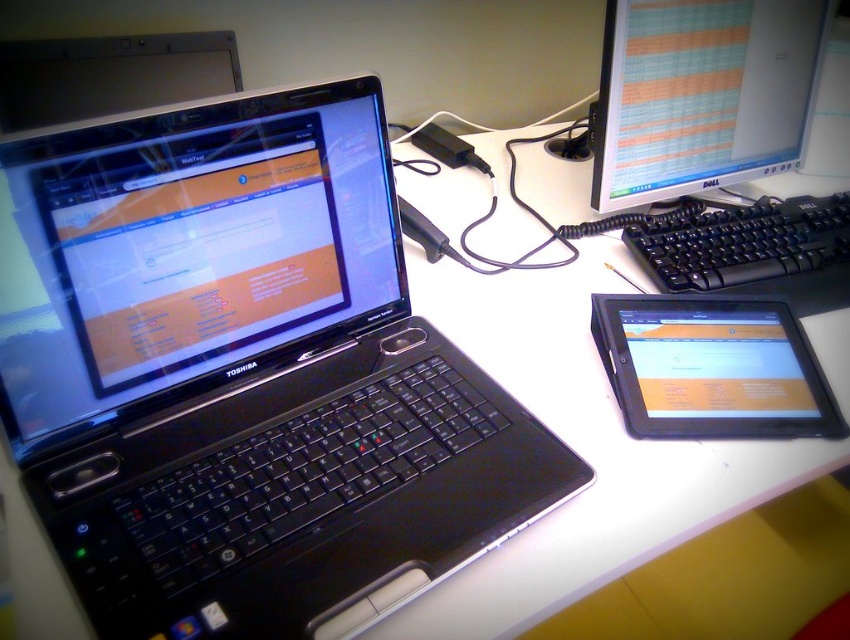
Does black plastic laptop at left have a smaller size compared to matte plastic monitor at upper right?

No.

Can you confirm if black plastic laptop at left is positioned to the left of matte plastic monitor at upper right?

Yes, black plastic laptop at left is to the left of matte plastic monitor at upper right.

Does point (364, 433) lie in front of point (768, 45)?

That is True.

Identify the location of black plastic laptop at left. The height and width of the screenshot is (640, 850). (242, 374).

Which of these two, black matte tablet at lower right or black plastic keyboard at right, stands taller?

black plastic keyboard at right is taller.

Does black matte tablet at lower right come in front of black plastic keyboard at right?

Answer: That is True.

Find the location of a particular element. The height and width of the screenshot is (640, 850). black matte tablet at lower right is located at coordinates (712, 368).

Identify the location of black matte tablet at lower right. The image size is (850, 640). (712, 368).

Which is behind, point (710, 40) or point (633, 307)?

The point (710, 40) is behind.

Where is `matte plastic monitor at upper right`? The image size is (850, 640). matte plastic monitor at upper right is located at coordinates (701, 93).